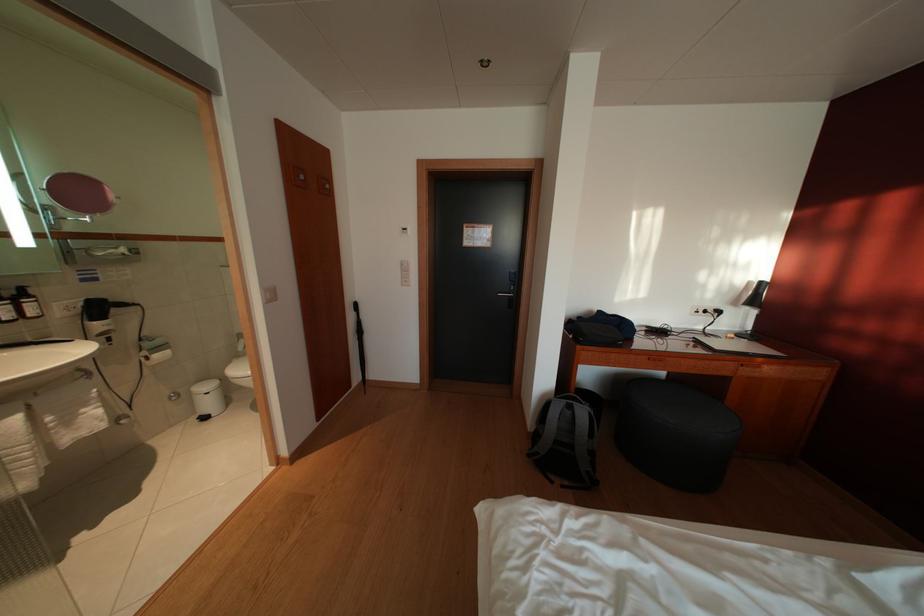
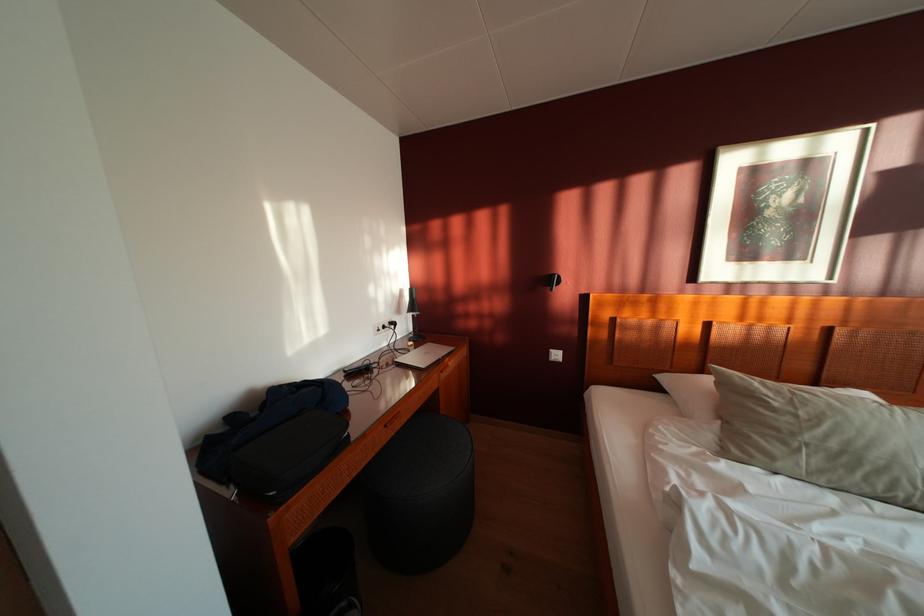
Question: I am providing you with two images of the same scene from different viewpoints. Please identify which objects are invisible in image2.

Choices:
 (A) black power plug
 (B) black desk lamp
 (C) black stool
 (D) none of these

Answer: (D)